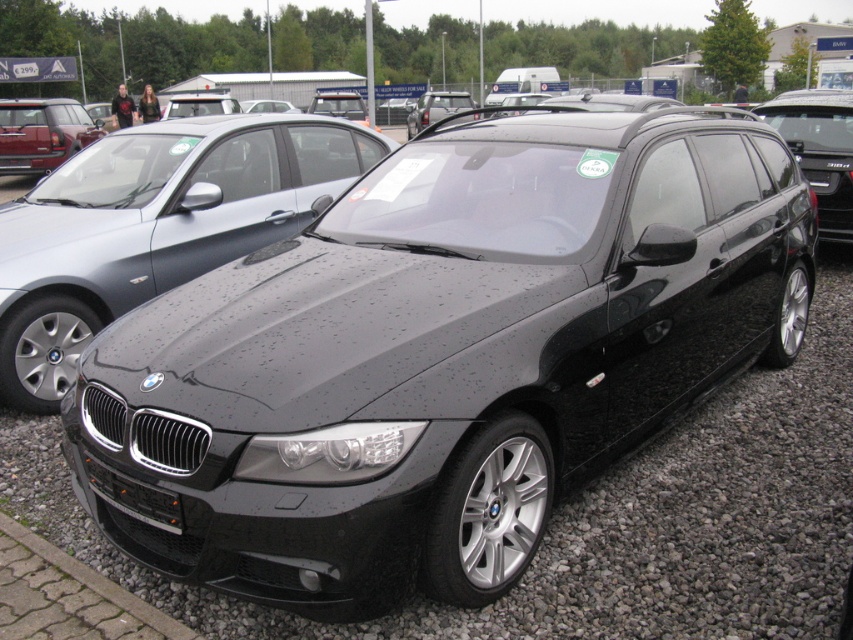
Based on the scene description, where is the black plastic license plate at front located in terms of coordinates?

The black plastic license plate at front is located at point [134,497].

You are a delivery person who needs to park a van that is 8 meters long in the space between the black gravel at center and the matte black car at center. Can you fit your van in that space?

The distance between the black gravel at center and the matte black car at center is 9.01 meters. Since your van is 8 meters long, it can fit in the space as there is enough room.